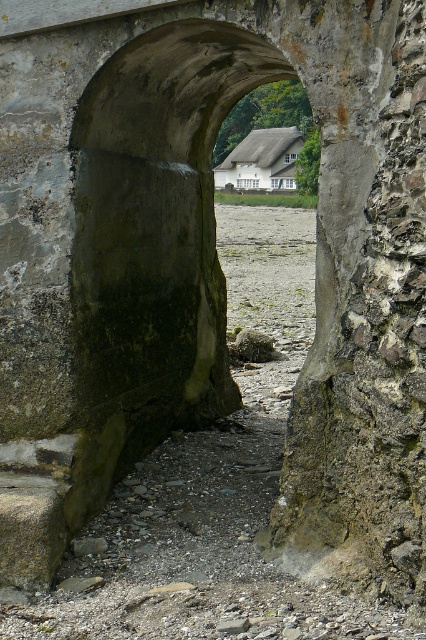
Question: Is dark gray stone archway at center positioned at the back of white wooden house at center?

Choices:
 (A) yes
 (B) no

Answer: (B)

Question: Which point appears closest to the camera in this image?

Choices:
 (A) (201, 416)
 (B) (247, 141)

Answer: (A)

Question: Which point is farther from the camera taking this photo?

Choices:
 (A) (290, 172)
 (B) (160, 316)

Answer: (A)

Question: Can you confirm if dark gray stone archway at center is wider than white wooden house at center?

Choices:
 (A) yes
 (B) no

Answer: (B)

Question: Is dark gray stone archway at center wider than white wooden house at center?

Choices:
 (A) no
 (B) yes

Answer: (A)